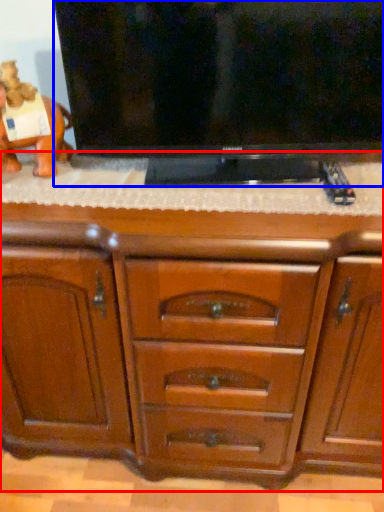
Question: Which object appears farthest to the camera in this image, chest of drawers (highlighted by a red box) or television (highlighted by a blue box)?

Choices:
 (A) chest of drawers
 (B) television

Answer: (B)